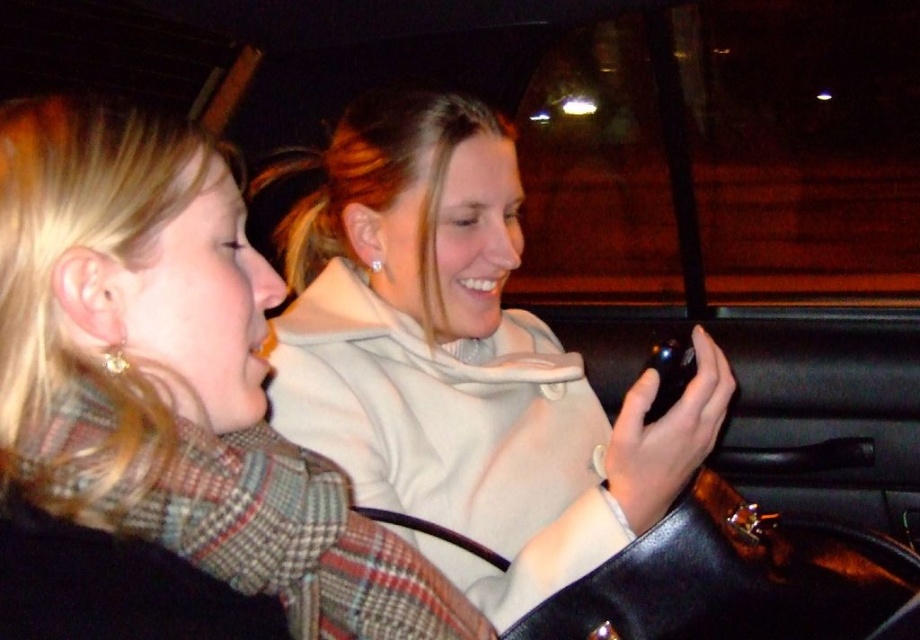
Between point (230, 554) and point (512, 609), which one is positioned behind?

The point (512, 609) is more distant.

Does plaid wool scarf at center have a greater height compared to white matte hoodie at center?

Incorrect, plaid wool scarf at center's height is not larger of white matte hoodie at center's.

Which is in front, point (59, 221) or point (349, 224)?

Positioned in front is point (59, 221).

Locate an element on the screen. Image resolution: width=920 pixels, height=640 pixels. plaid wool scarf at center is located at coordinates (173, 378).